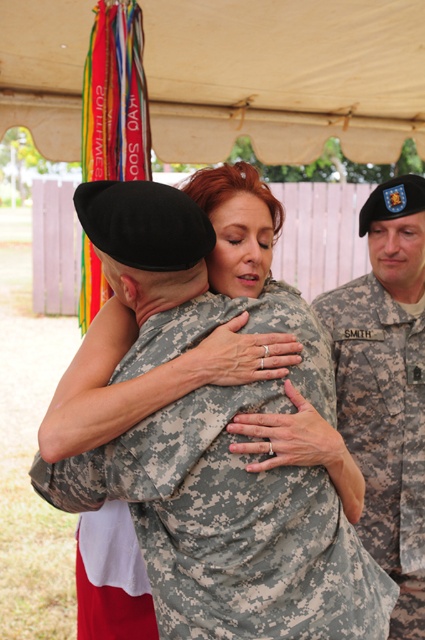
You are standing in front of the beige tent and want to determine which of the two points, point (34,484) or point (399,192), is nearer to you. Based on the scene, which point is closer?

Point (34,484) is closer to the viewer than point (399,192).

You are a photographer standing at the entrance of the beige tent. You want to take a photo of the camouflage fabric uniform at center and the white fabric canopy at upper center. Which object should you focus on first if you want to capture both in the same frame without moving the camera?

The camouflage fabric uniform at center is located below the white fabric canopy at upper center, so you should focus on the white fabric canopy at upper center first to ensure both are in frame.